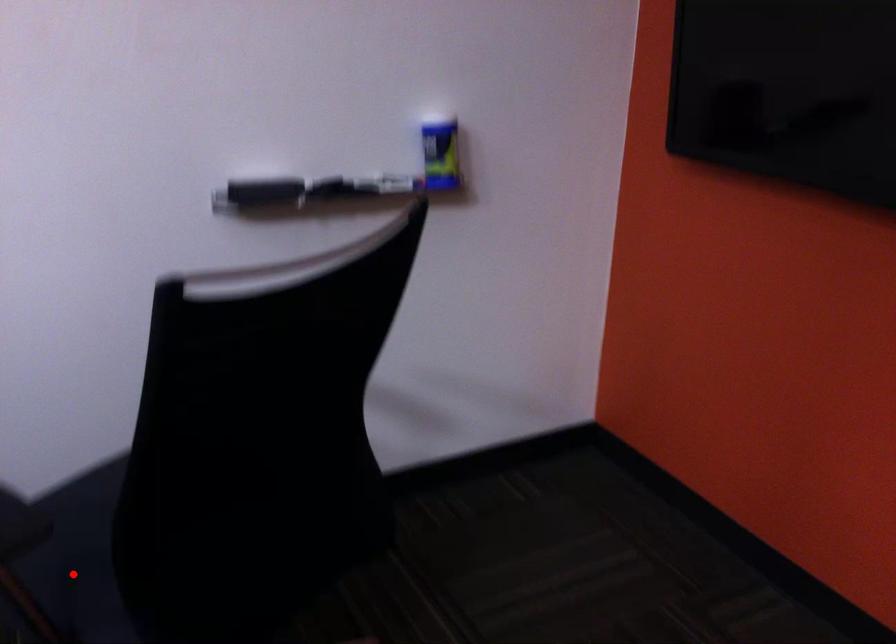
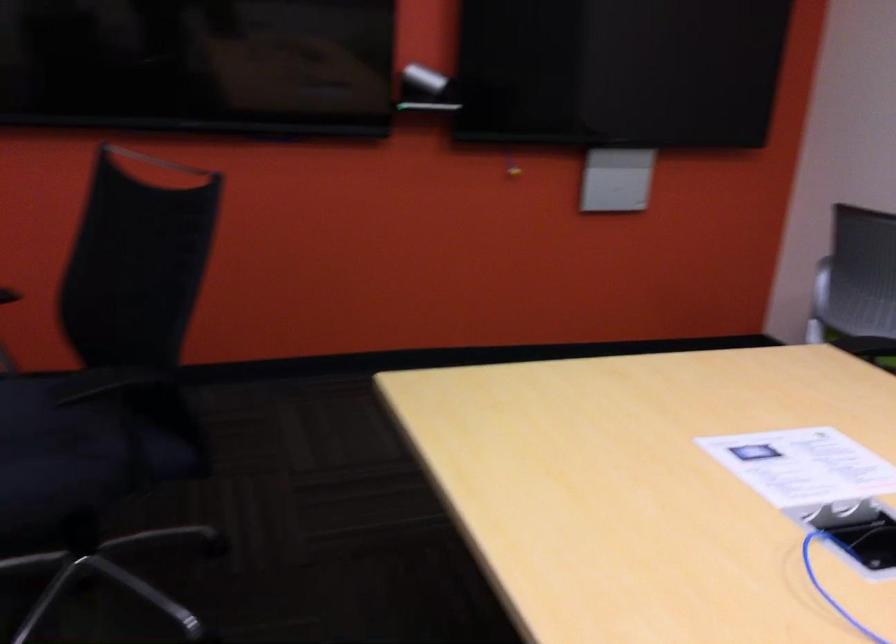
Where in the second image is the point corresponding to the highlighted location from the first image?

(82, 450)